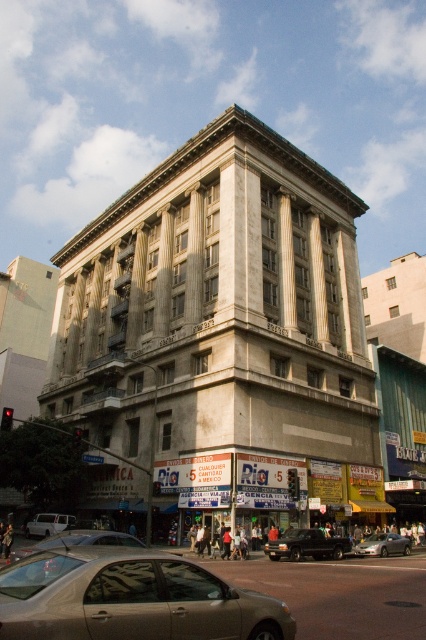
Question: Is gold metallic sedan at lower left to the left of black glossy van at center from the viewer's perspective?

Choices:
 (A) no
 (B) yes

Answer: (B)

Question: Estimate the real-world distances between objects in this image. Which object is farther from the silver metallic sedan at lower left?

Choices:
 (A) satin silver car at center
 (B) silver metallic van at lower left
 (C) black glossy van at center
 (D) white stone pillar at center

Answer: (D)

Question: Which object is the closest to the black glossy van at center?

Choices:
 (A) gold metallic sedan at lower left
 (B) silver metallic van at lower left
 (C) satin silver car at center
 (D) white stone pillar at center

Answer: (C)

Question: Does gold metallic sedan at lower left appear on the right side of silver metallic sedan at lower left?

Choices:
 (A) no
 (B) yes

Answer: (B)

Question: Considering the real-world distances, which object is farthest from the silver metallic sedan at lower left?

Choices:
 (A) white stone pillar at center
 (B) satin silver car at center

Answer: (A)

Question: Is gold metallic sedan at lower left smaller than black glossy van at center?

Choices:
 (A) no
 (B) yes

Answer: (A)